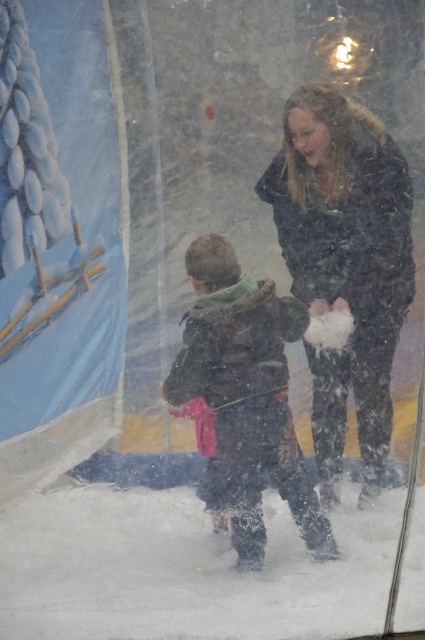
You are a photographer trying to capture a photo of the dark brown jacket at center and the dark green fuzzy jacket at center. Which jacket should you focus on first if you want to ensure both are in the frame without moving the camera?

The dark brown jacket at center is located above the dark green fuzzy jacket at center, so you should focus on the dark brown jacket at center first to ensure both are in the frame without moving the camera.